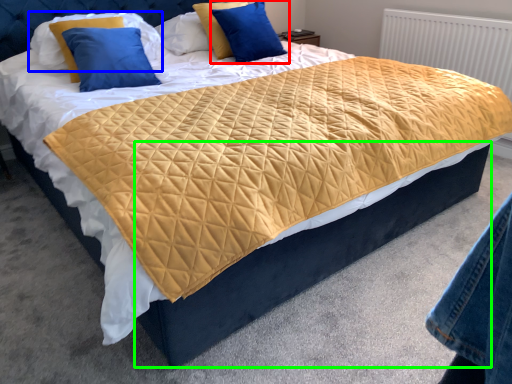
Question: Which object is positioned closest to pillow (highlighted by a red box)? Select from pillow (highlighted by a blue box) and bed frame (highlighted by a green box).

Choices:
 (A) pillow
 (B) bed frame

Answer: (A)